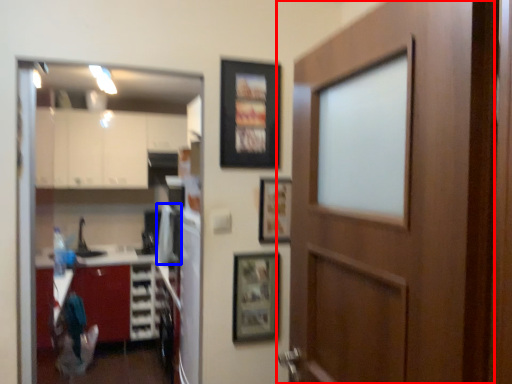
Question: Which object appears closest to the camera in this image, door (highlighted by a red box) or appliance (highlighted by a blue box)?

Choices:
 (A) door
 (B) appliance

Answer: (A)